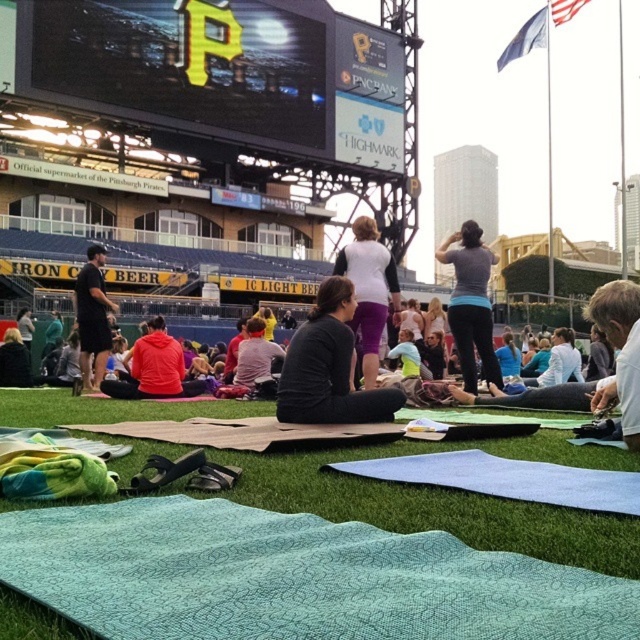
Question: Is dark gray fabric pants at center thinner than matte black jacket at lower left?

Choices:
 (A) yes
 (B) no

Answer: (B)

Question: Which point appears farthest from the camera in this image?

Choices:
 (A) (621, 371)
 (B) (470, 310)
 (C) (256, 20)

Answer: (C)

Question: Can you confirm if light blue fabric yoga mat at lower center is wider than matte white shirt at center?

Choices:
 (A) yes
 (B) no

Answer: (A)

Question: Is dark gray fabric pants at center bigger than dark gray hoodie at left?

Choices:
 (A) no
 (B) yes

Answer: (A)

Question: Which object is the farthest from the matte white shirt at center?

Choices:
 (A) dark gray fabric pants at center
 (B) matte black hoodie at center
 (C) green textured mat at center
 (D) dark gray hoodie at left

Answer: (D)

Question: Based on their relative distances, which object is farther from the black matte scoreboard at upper center?

Choices:
 (A) dark gray fabric pants at center
 (B) green textured mat at center
 (C) light brown leather jacket at lower right
 (D) matte black jacket at lower left

Answer: (A)